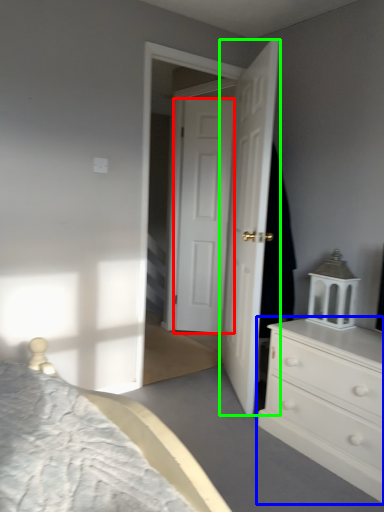
Question: Which is nearer to the door (highlighted by a red box)? chest of drawers (highlighted by a blue box) or door (highlighted by a green box).

Choices:
 (A) chest of drawers
 (B) door

Answer: (B)